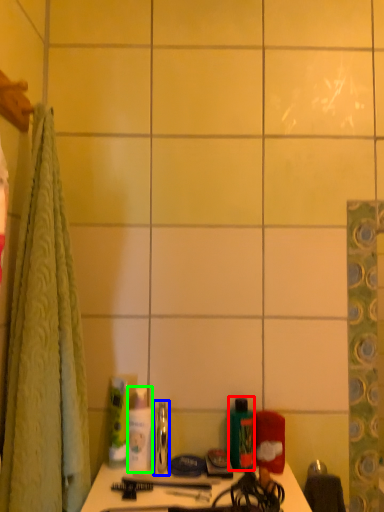
Question: Based on their relative distances, which object is farther from mouthwash (highlighted by a red box)? Choose from mouthwash (highlighted by a blue box) and toiletry (highlighted by a green box).

Choices:
 (A) mouthwash
 (B) toiletry

Answer: (B)